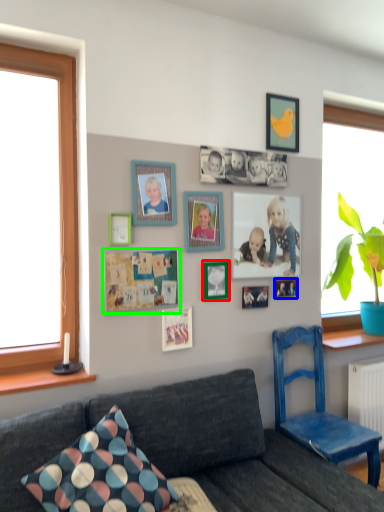
Question: Based on their relative distances, which object is farther from picture frame (highlighted by a red box)? Choose from picture frame (highlighted by a blue box) and bulletin board (highlighted by a green box).

Choices:
 (A) picture frame
 (B) bulletin board

Answer: (A)